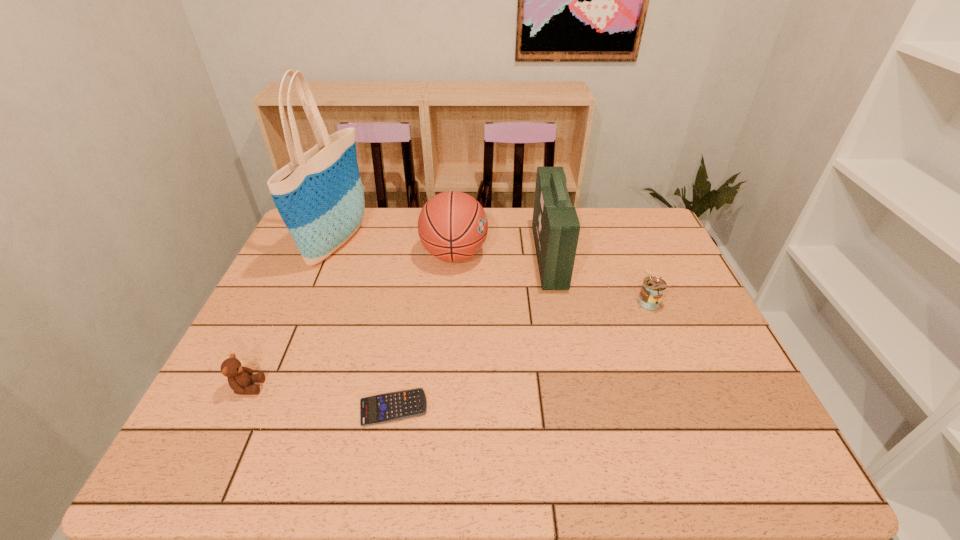
This screenshot has width=960, height=540. Identify the location of vacant area located on the front-facing side of the second object from right to left. pos(420,256).

The image size is (960, 540). I want to click on free space located 0.080m on the front-facing side of the second object from right to left, so click(x=511, y=256).

At what (x,y) coordinates should I click in order to perform the action: click on free space located on the logo side of the basketball. Please return your answer as a coordinate pair (x, y). Looking at the image, I should click on (514, 254).

The image size is (960, 540). In order to click on free space located on the left of the third nearest object in this screenshot , I will do `click(589, 302)`.

Locate an element on the screen. The height and width of the screenshot is (540, 960). vacant space located 0.060m on the face of the teddy bear is located at coordinates (290, 387).

Identify the location of free location located on the right of the calculator. (492, 407).

This screenshot has height=540, width=960. In order to click on tote bag at the far edge in this screenshot , I will do tap(319, 195).

Where is `the first-aid kit that is positioned at the far edge`? This screenshot has width=960, height=540. the first-aid kit that is positioned at the far edge is located at coordinates (555, 224).

Where is `basketball present at the far edge`? This screenshot has width=960, height=540. basketball present at the far edge is located at coordinates (452, 226).

Where is `tote bag located in the left edge section of the desktop`? The image size is (960, 540). tote bag located in the left edge section of the desktop is located at coordinates (319, 195).